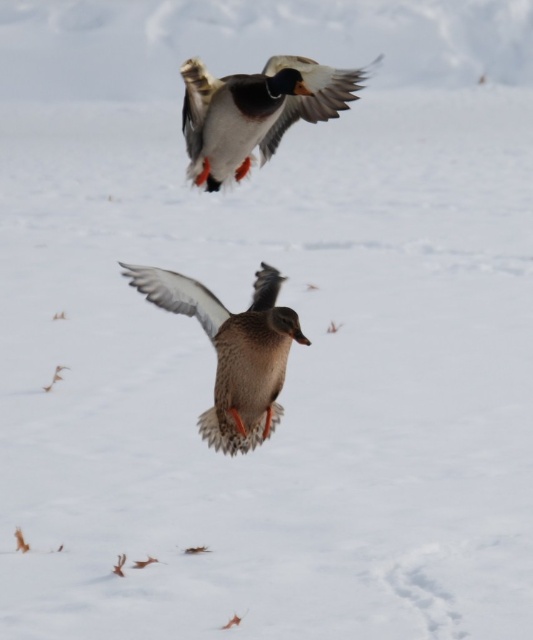
Question: Which point is closer to the camera?

Choices:
 (A) brown feathered duck at center
 (B) speckled feathered duck at upper center

Answer: (A)

Question: Does brown feathered duck at center appear under speckled feathered duck at upper center?

Choices:
 (A) no
 (B) yes

Answer: (B)

Question: Can you confirm if brown feathered duck at center is positioned to the right of speckled feathered duck at upper center?

Choices:
 (A) no
 (B) yes

Answer: (A)

Question: Is brown feathered duck at center positioned before speckled feathered duck at upper center?

Choices:
 (A) yes
 (B) no

Answer: (A)